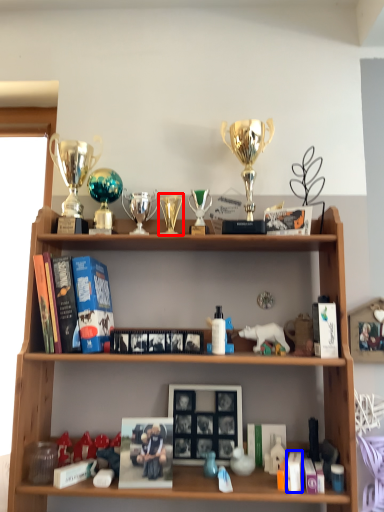
Question: Which point is closer to the camera, candle holder (highlighted by a red box) or book (highlighted by a blue box)?

Choices:
 (A) candle holder
 (B) book

Answer: (B)